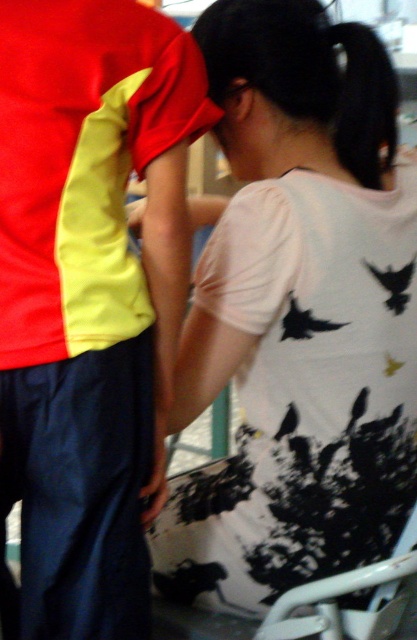
Question: Does white matte shirt at center have a larger size compared to matte red-yellow shirt at center?

Choices:
 (A) no
 (B) yes

Answer: (B)

Question: Which point appears closest to the camera in this image?

Choices:
 (A) (77, 257)
 (B) (206, 545)

Answer: (A)

Question: Which point is farther from the camera taking this photo?

Choices:
 (A) tap(284, 522)
 (B) tap(34, 157)

Answer: (A)

Question: Which point is farther from the camera taking this photo?

Choices:
 (A) (30, 586)
 (B) (268, 49)

Answer: (B)

Question: Can you confirm if white matte shirt at center is positioned to the right of matte red-yellow shirt at center?

Choices:
 (A) yes
 (B) no

Answer: (A)

Question: Can you confirm if white matte shirt at center is positioned to the right of matte red-yellow shirt at center?

Choices:
 (A) yes
 (B) no

Answer: (A)